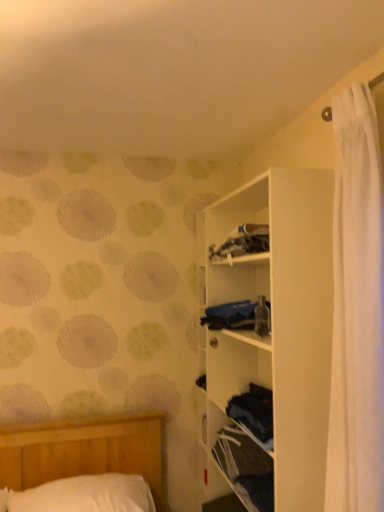
At what (x,y) coordinates should I click in order to perform the action: click on blue fabric at center. Please return your answer as a coordinate pair (x, y). The width and height of the screenshot is (384, 512). Looking at the image, I should click on (230, 316).

Is white soft pillow at lower left further to the viewer compared to blue fabric at center?

No, it is in front of blue fabric at center.

From a real-world perspective, which object stands above the other?

In real-world perspective, blue fabric at center is above.

From the image's perspective, is white soft pillow at lower left located above blue fabric at center?

No.

At what (x,y) coordinates should I click in order to perform the action: click on pillow in front of the blue fabric at center. Please return your answer as a coordinate pair (x, y). Looking at the image, I should click on (86, 495).

What's the angular difference between blue fabric at center and white soft pillow at lower left's facing directions?

They differ by 89.6 degrees in their facing directions.

Measure the distance from blue fabric at center to white soft pillow at lower left.

blue fabric at center is 36.56 inches away from white soft pillow at lower left.

Is blue fabric at center not inside white soft pillow at lower left?

Yes, blue fabric at center is located beyond the bounds of white soft pillow at lower left.

The height and width of the screenshot is (512, 384). I want to click on pillow that is on the left side of blue fabric at center, so click(x=86, y=495).

Consider the image. From the image's perspective, is white matte shelf at upper right located above or below blue fabric at center?

white matte shelf at upper right is below blue fabric at center.

Looking at this image, is white matte shelf at upper right facing away from blue fabric at center?

Correct, white matte shelf at upper right is looking away from blue fabric at center.

Which is behind, white matte shelf at upper right or blue fabric at center?

Positioned behind is blue fabric at center.

Identify the location of shelf that appears above the white soft pillow at lower left (from a real-world perspective). (268, 341).

Can you tell me how much white matte shelf at upper right and white soft pillow at lower left differ in facing direction?

white matte shelf at upper right and white soft pillow at lower left are facing 90.3 degrees away from each other.

Is white matte shelf at upper right not inside white soft pillow at lower left?

Yes, white matte shelf at upper right is located beyond the bounds of white soft pillow at lower left.

Are white matte shelf at upper right and white soft pillow at lower left located far from each other?

No, white matte shelf at upper right is not far away from white soft pillow at lower left.

Are blue fabric at center and white matte shelf at upper right located far from each other?

That's not correct — blue fabric at center is a little close to white matte shelf at upper right.

Considering the sizes of objects blue fabric at center and white matte shelf at upper right in the image provided, who is thinner, blue fabric at center or white matte shelf at upper right?

Thinner between the two is blue fabric at center.

Is point (202, 325) closer or farther from the camera than point (227, 415)?

Point (202, 325).

Measure the distance between blue fabric at center and white matte shelf at upper right.

blue fabric at center and white matte shelf at upper right are 14.54 inches apart.

Where is `pillow located on the left of white matte shelf at upper right`? pillow located on the left of white matte shelf at upper right is located at coordinates (86, 495).

What's the angular difference between white soft pillow at lower left and white matte shelf at upper right's facing directions?

The angle between the facing direction of white soft pillow at lower left and the facing direction of white matte shelf at upper right is 90.3 degrees.

Which point is more distant from viewer, (69, 501) or (312, 431)?

Point (69, 501)

Considering the sizes of white soft pillow at lower left and white matte shelf at upper right in the image, is white soft pillow at lower left wider or thinner than white matte shelf at upper right?

In the image, white soft pillow at lower left appears to be wider than white matte shelf at upper right.

I want to click on pillow beneath the blue fabric at center (from a real-world perspective), so click(86, 495).

Identify the location of pillow on the left of blue fabric at center. (86, 495).

Based on their spatial positions, is blue fabric at center or white matte shelf at upper right further from white soft pillow at lower left?

Based on the image, blue fabric at center appears to be further to white soft pillow at lower left.

Based on their spatial positions, is white soft pillow at lower left or blue fabric at center further from white matte shelf at upper right?

Among the two, white soft pillow at lower left is located further to white matte shelf at upper right.

From the image, which object appears to be nearer to blue fabric at center, white soft pillow at lower left or white matte shelf at upper right?

Among the two, white matte shelf at upper right is located nearer to blue fabric at center.

Based on their spatial positions, is white matte shelf at upper right or white soft pillow at lower left further from blue fabric at center?

The object further to blue fabric at center is white soft pillow at lower left.

When comparing their distances from white matte shelf at upper right, does blue fabric at center or white soft pillow at lower left seem closer?

blue fabric at center is closer to white matte shelf at upper right.

When comparing their distances from white soft pillow at lower left, does white matte shelf at upper right or blue fabric at center seem closer?

white matte shelf at upper right is positioned closer to the anchor white soft pillow at lower left.

Locate an element on the screen. shelf between blue fabric at center and white soft pillow at lower left in the up-down direction is located at coordinates (268, 341).